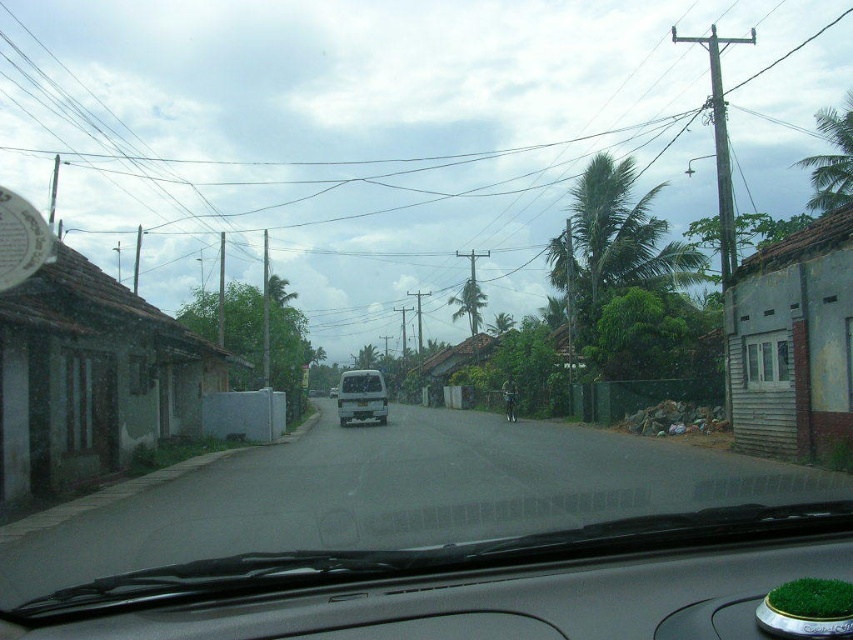
Question: Is white matte van at center bigger than green leafy palm tree at center?

Choices:
 (A) yes
 (B) no

Answer: (B)

Question: Is green leafy palm tree at center wider than clear glass windshield at center?

Choices:
 (A) no
 (B) yes

Answer: (B)

Question: Is green leafy palm tree at upper right wider than clear glass windshield at center?

Choices:
 (A) no
 (B) yes

Answer: (B)

Question: Which of the following is the closest to the observer?

Choices:
 (A) (349, 378)
 (B) (838, 118)

Answer: (A)

Question: Which is nearer to the clear glass windshield at center?

Choices:
 (A) green leafy palm tree at upper right
 (B) white matte van at center

Answer: (B)

Question: Which point is farther to the camera?

Choices:
 (A) white matte van at center
 (B) clear glass windshield at center
 (C) green leafy palm tree at upper right
 (D) green leafy palm tree at center

Answer: (D)